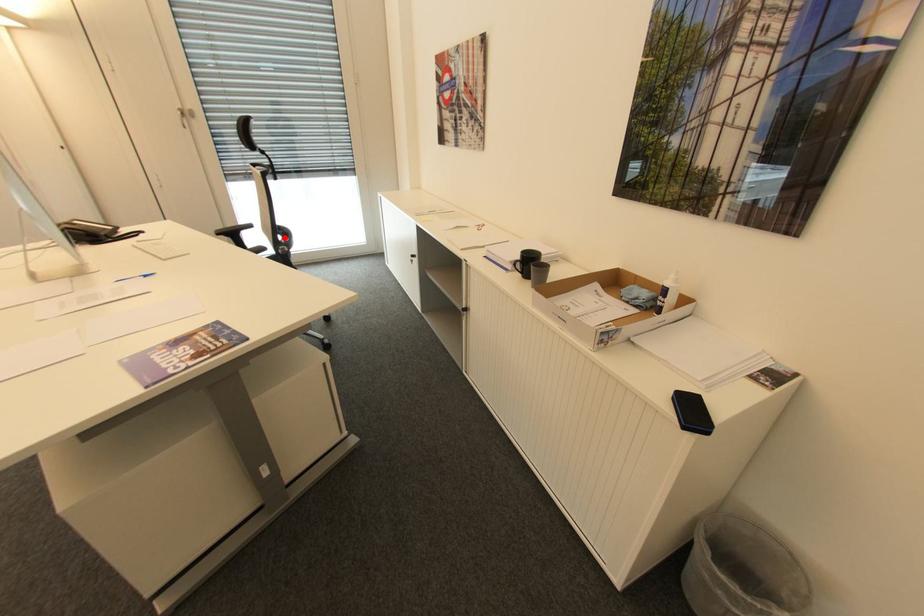
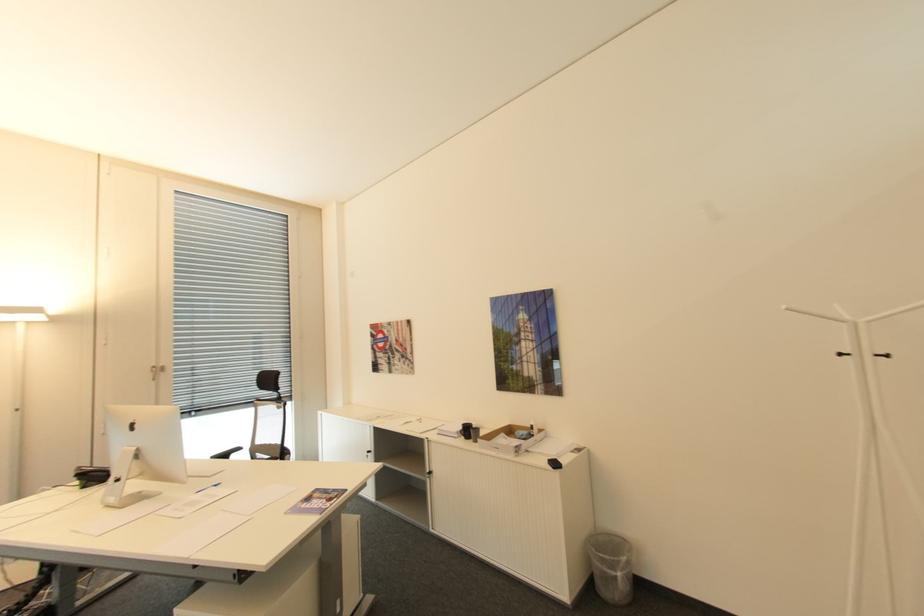
Question: I am providing you with two images of the same scene from different viewpoints. A red point is marked on the first image. At the location where the point appears in image 1, is it still visible in image 2?

Choices:
 (A) Yes
 (B) No

Answer: (B)